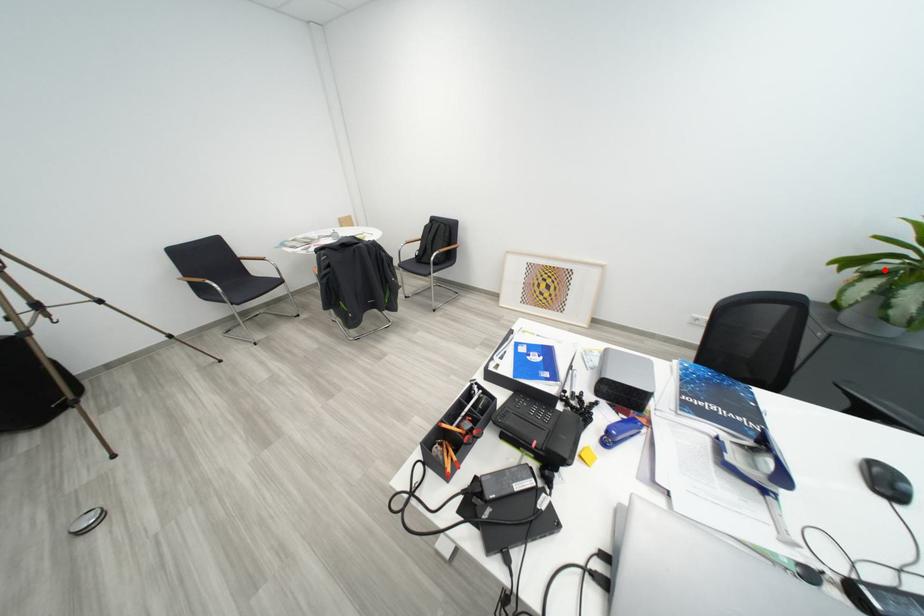
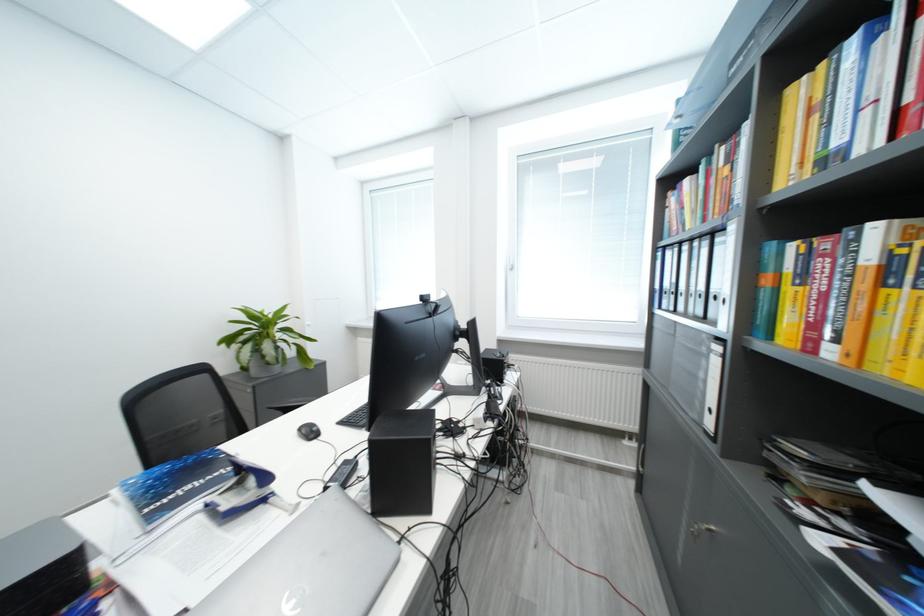
Question: I am providing you with two images of the same scene from different viewpoints. In image1, a red point is highlighted. Considering the same 3D point in image2, which of the following is correct?

Choices:
 (A) It is closer
 (B) It is farther

Answer: (A)